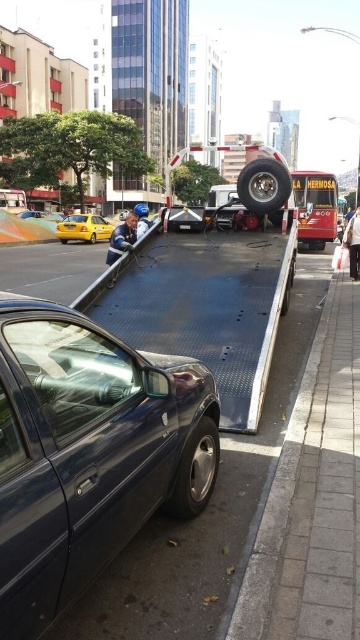
Which is in front, point (163, 323) or point (84, 237)?

Point (163, 323) is more forward.

Does metallic flatbed at center have a smaller size compared to yellow matte taxi at left?

Incorrect, metallic flatbed at center is not smaller in size than yellow matte taxi at left.

Identify the location of metallic flatbed at center. point(204,307).

Can you confirm if matte dark blue sedan at center is taller than metallic flatbed at center?

No.

Can you confirm if matte dark blue sedan at center is smaller than metallic flatbed at center?

Yes, matte dark blue sedan at center is smaller than metallic flatbed at center.

This screenshot has width=360, height=640. What do you see at coordinates (87, 452) in the screenshot? I see `matte dark blue sedan at center` at bounding box center [87, 452].

Identify the location of matte dark blue sedan at center. This screenshot has height=640, width=360. click(x=87, y=452).

Does matte dark blue sedan at center have a lesser width compared to yellow matte taxi at left?

Yes, matte dark blue sedan at center is thinner than yellow matte taxi at left.

Which is behind, point (164, 378) or point (69, 230)?

Point (69, 230)

Image resolution: width=360 pixels, height=640 pixels. What are the coordinates of `matte dark blue sedan at center` in the screenshot? It's located at (87, 452).